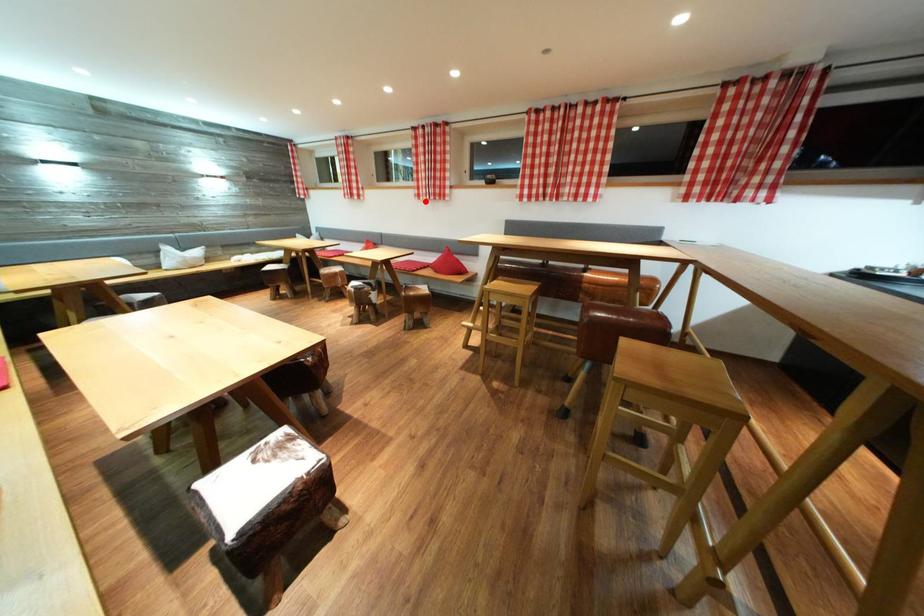
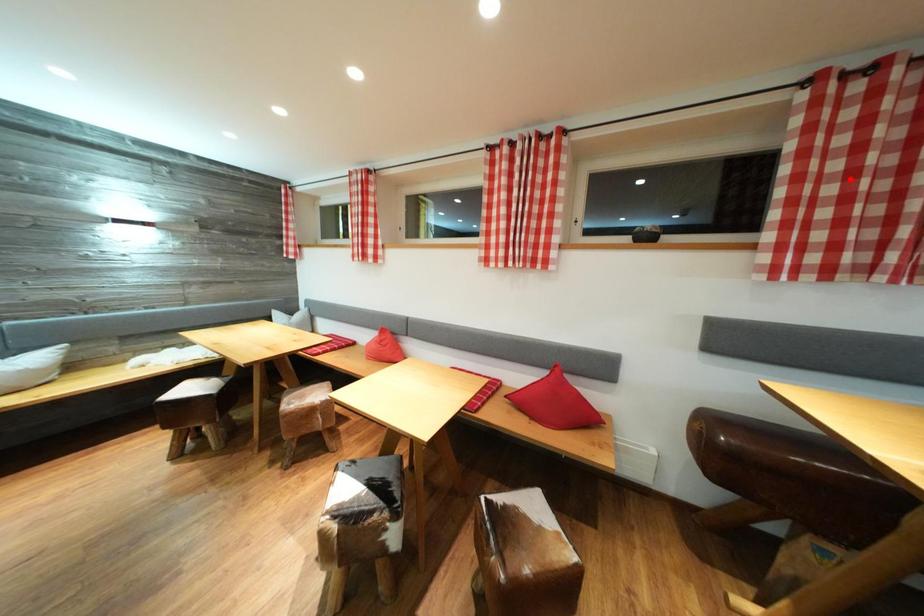
I am providing you with two images of the same scene from different viewpoints. A red point is marked on the first image and another point is marked on the second image. Do the highlighted points in image1 and image2 indicate the same real-world spot?

No